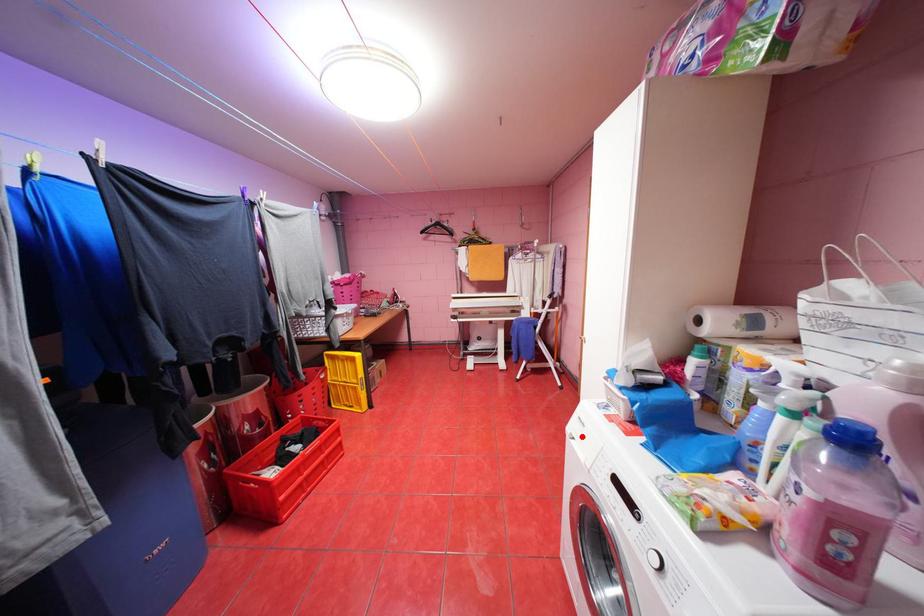
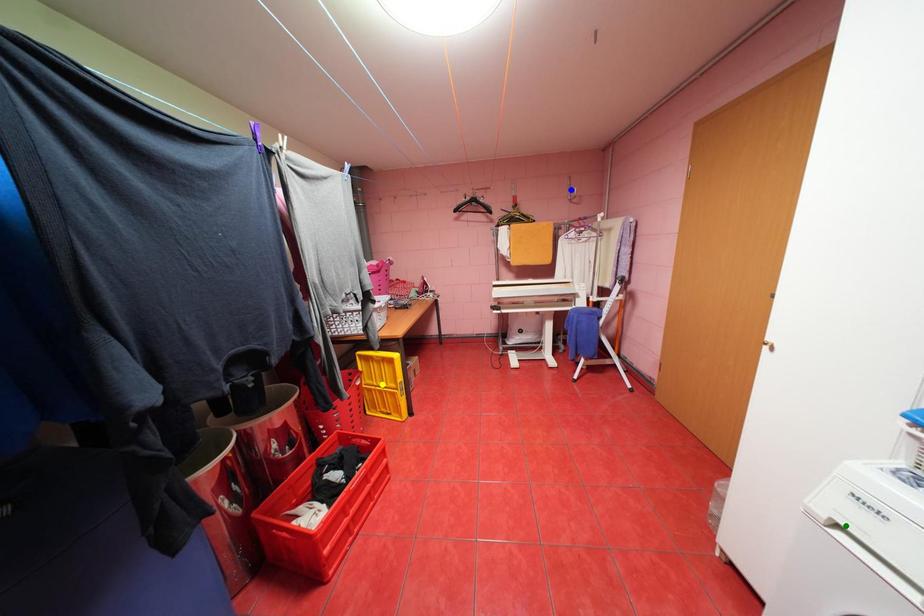
Question: I am providing you with two images of the same scene from different viewpoints. A red point is marked on the first image. You are given multiple points on the second image. Which point in image 2 represents the same 3d spot as the red point in image 1?

Choices:
 (A) yellow point
 (B) blue point
 (C) green point

Answer: (C)